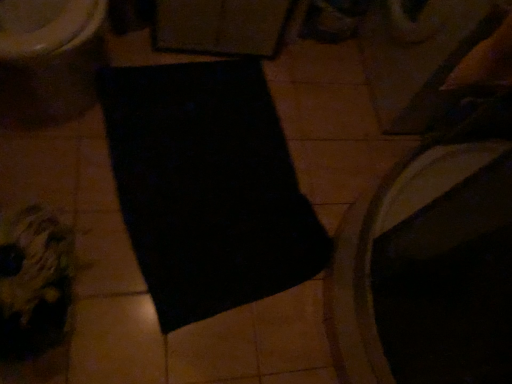
Question: Is black matte yoga mat at center wider or thinner than matte white toilet at upper left?

Choices:
 (A) wide
 (B) thin

Answer: (A)

Question: Visually, is black matte yoga mat at center positioned to the left or to the right of matte white toilet at upper left?

Choices:
 (A) left
 (B) right

Answer: (B)

Question: From a real-world perspective, is black matte yoga mat at center physically located above or below matte white toilet at upper left?

Choices:
 (A) below
 (B) above

Answer: (A)

Question: Is point (89, 69) closer or farther from the camera than point (214, 246)?

Choices:
 (A) farther
 (B) closer

Answer: (A)

Question: From a real-world perspective, is matte white toilet at upper left physically located above or below black matte yoga mat at center?

Choices:
 (A) above
 (B) below

Answer: (A)

Question: Considering their positions, is matte white toilet at upper left located in front of or behind black matte yoga mat at center?

Choices:
 (A) behind
 (B) front

Answer: (B)

Question: Choose the correct answer: Is matte white toilet at upper left inside black matte yoga mat at center or outside it?

Choices:
 (A) inside
 (B) outside

Answer: (B)